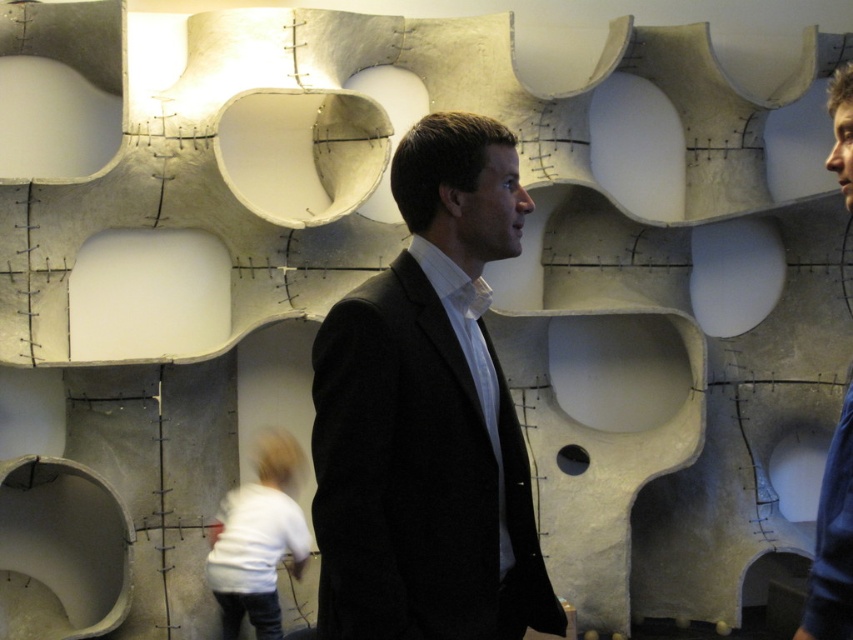
Question: Is black matte suit at center closer to camera compared to dark blue sweater at right?

Choices:
 (A) yes
 (B) no

Answer: (B)

Question: Which point is closer to the camera?

Choices:
 (A) (850, 557)
 (B) (433, 637)

Answer: (A)

Question: Does black matte suit at center come in front of dark blue sweater at right?

Choices:
 (A) no
 (B) yes

Answer: (A)

Question: Does black matte suit at center have a lesser width compared to dark blue sweater at right?

Choices:
 (A) no
 (B) yes

Answer: (A)

Question: Among these points, which one is farthest from the camera?

Choices:
 (A) (421, 294)
 (B) (833, 552)

Answer: (A)

Question: Which point is farther from the camera taking this photo?

Choices:
 (A) (399, 305)
 (B) (846, 572)

Answer: (A)